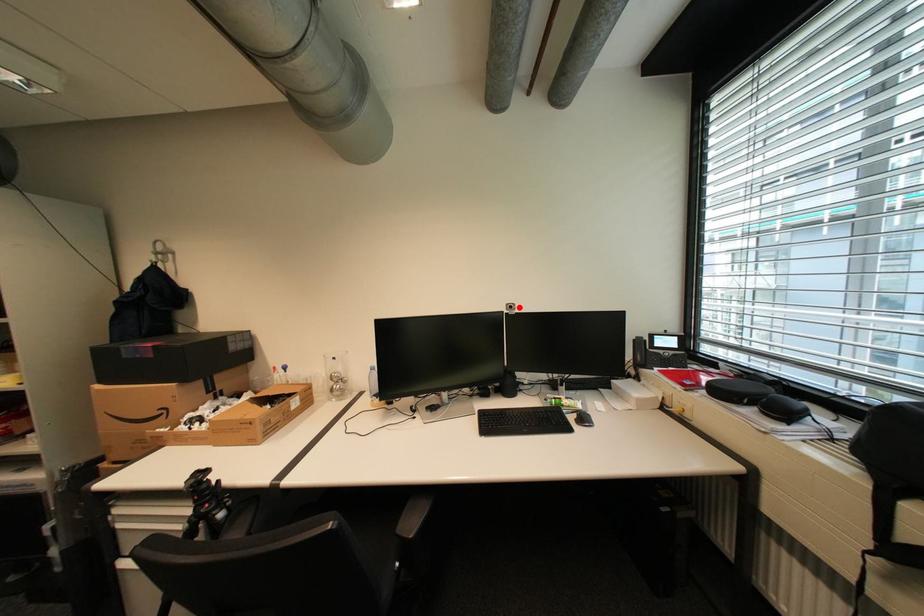
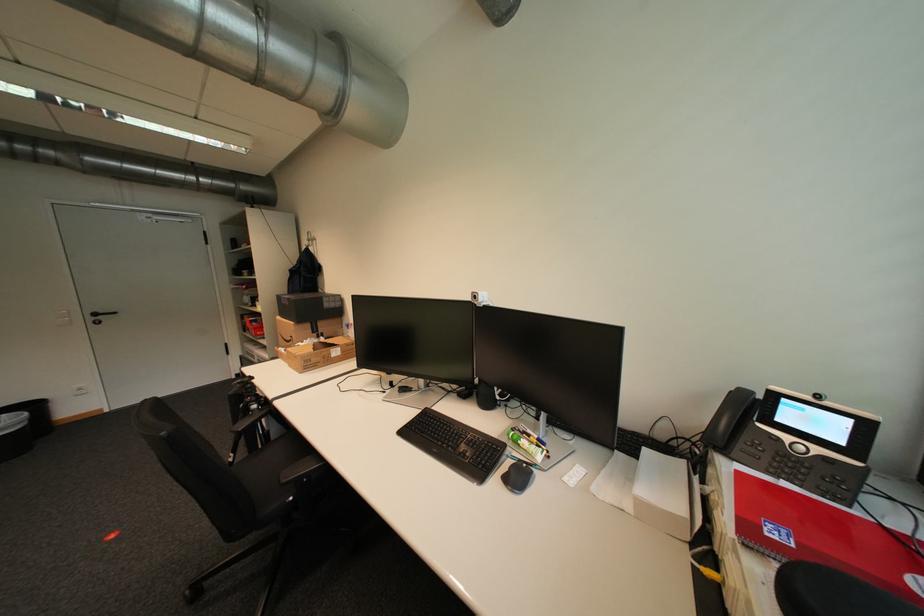
Locate, in the second image, the point that corresponds to the highlighted location in the first image.

(483, 297)